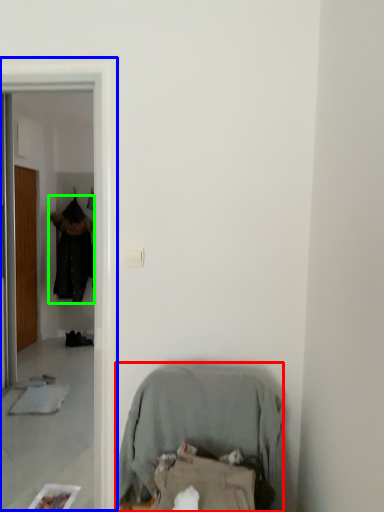
Question: Which is farther away from furniture (highlighted by a red box)? screen door (highlighted by a blue box) or clothing (highlighted by a green box)?

Choices:
 (A) screen door
 (B) clothing

Answer: (B)